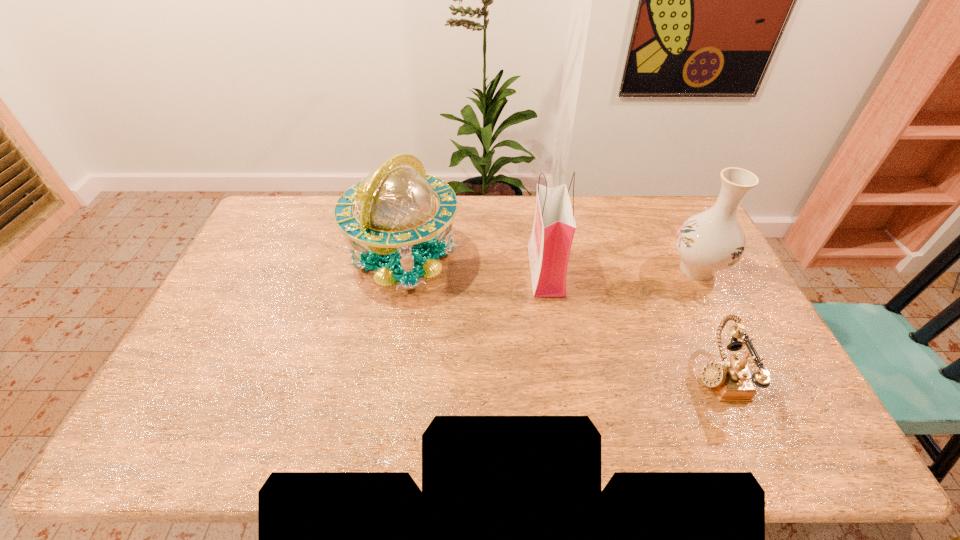
In the image, there is a desktop. Identify the location of vacant space at the near left corner. This screenshot has width=960, height=540. (192, 427).

In the image, there is a desktop. Where is `vacant space at the near right corner`? This screenshot has height=540, width=960. vacant space at the near right corner is located at coordinates (754, 437).

Where is `free space between the shortest object and the globe`? The height and width of the screenshot is (540, 960). free space between the shortest object and the globe is located at coordinates (562, 317).

Image resolution: width=960 pixels, height=540 pixels. Find the location of `free space between the vase and the nearest object`. free space between the vase and the nearest object is located at coordinates (708, 322).

The height and width of the screenshot is (540, 960). Find the location of `unoccupied area between the leftmost object and the second object from left to right`. unoccupied area between the leftmost object and the second object from left to right is located at coordinates (475, 265).

Where is `empty location between the leftmost object and the third object from right to left`? empty location between the leftmost object and the third object from right to left is located at coordinates (475, 265).

Image resolution: width=960 pixels, height=540 pixels. What are the coordinates of `vacant point located between the second object from left to right and the leftmost object` in the screenshot? It's located at (475, 265).

Identify the location of vacant area that lies between the nearest object and the vase. The image size is (960, 540). (708, 322).

You are a GUI agent. You are given a task and a screenshot of the screen. Output one action in this format:
    pyautogui.click(x=<x>, y=<y>)
    Task: Click on the free point between the vase and the shopping bag
    
    Given the screenshot: What is the action you would take?
    pyautogui.click(x=621, y=269)

At what (x,y) coordinates should I click in order to perform the action: click on unoccupied area between the shortest object and the vase. Please return your answer as a coordinate pair (x, y). This screenshot has height=540, width=960. Looking at the image, I should click on (708, 322).